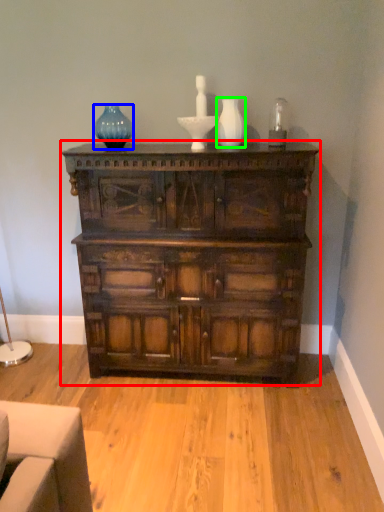
Question: Based on their relative distances, which object is farther from chest of drawers (highlighted by a red box)? Choose from glass vase (highlighted by a blue box) and vase (highlighted by a green box).

Choices:
 (A) glass vase
 (B) vase

Answer: (A)